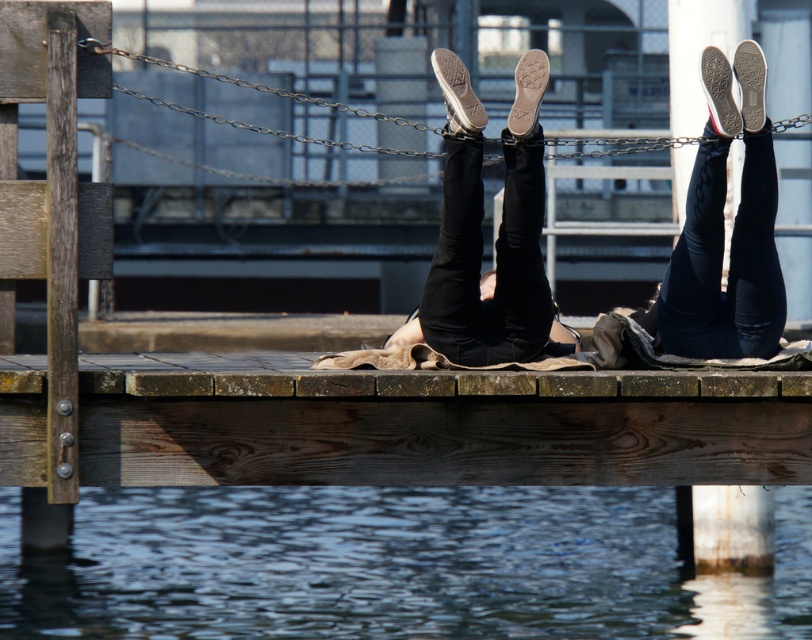
You are standing on the wooden pier and want to place a small potted plant between the clear water at lower center and the matte black leggings at center. Which object should you place it closer to to ensure it is closer to the viewer?

The clear water at lower center is closer to the viewer than the matte black leggings at center. Therefore, placing the potted plant closer to the clear water at lower center will make it nearer to the viewer.

You are standing at the point labeled point (759, 252) on the wooden pier and want to walk to the point labeled point (150, 506). Which direction should you move relative to the pier?

You should move forward along the pier towards point (150, 506) because it is behind point (759, 252).